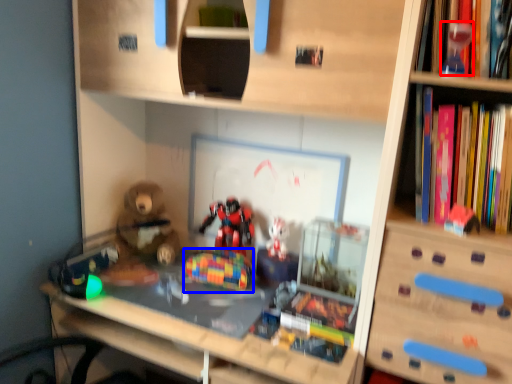
Question: Among these objects, which one is nearest to the camera, toy (highlighted by a red box) or toy (highlighted by a blue box)?

Choices:
 (A) toy
 (B) toy

Answer: (A)